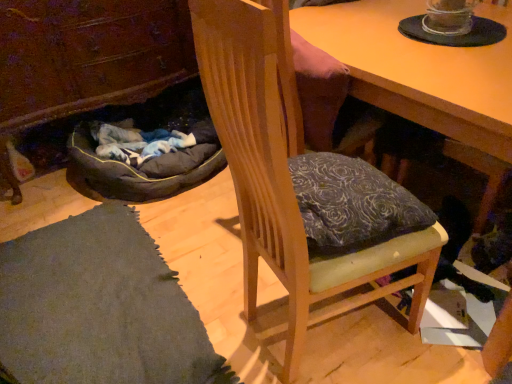
The image size is (512, 384). I want to click on wooden cabinet at lower left, so click(x=85, y=59).

Describe the element at coordinates (421, 69) in the screenshot. I see `wooden desk at center` at that location.

This screenshot has height=384, width=512. I want to click on wooden cabinet at lower left, so click(85, 59).

Considering the sizes of objects wooden cabinet at lower left and wooden chair at center in the image provided, who is smaller, wooden cabinet at lower left or wooden chair at center?

wooden chair at center is smaller.

Which point is more forward, (x=112, y=86) or (x=255, y=106)?

Positioned in front is point (x=255, y=106).

Identify the location of cabinetry above the wooden chair at center (from the image's perspective). (85, 59).

Is wooden cabinet at lower left wider than wooden chair at center?

Correct, the width of wooden cabinet at lower left exceeds that of wooden chair at center.

From a real-world perspective, between wooden desk at center and wooden chair at center, who is vertically lower?

From a 3D spatial view, wooden desk at center is below.

Measure the distance between wooden desk at center and wooden chair at center.

wooden desk at center and wooden chair at center are 17.77 inches apart.

From the image's perspective, is wooden desk at center under wooden chair at center?

No.

Is point (367, 80) farther from camera compared to point (394, 271)?

Yes, it is.

Considering the relative sizes of wooden cabinet at lower left and wooden desk at center in the image provided, is wooden cabinet at lower left shorter than wooden desk at center?

No, wooden cabinet at lower left is not shorter than wooden desk at center.

Based on their sizes in the image, would you say wooden cabinet at lower left is bigger or smaller than wooden desk at center?

Considering their sizes, wooden cabinet at lower left takes up less space than wooden desk at center.

Would you consider wooden cabinet at lower left to be distant from wooden desk at center?

wooden cabinet at lower left is positioned a significant distance from wooden desk at center.

Is wooden cabinet at lower left positioned with its back to wooden desk at center?

No, wooden cabinet at lower left is not facing away from wooden desk at center.

From a real-world perspective, is wooden chair at center beneath wooden cabinet at lower left?

Actually, wooden chair at center is physically above wooden cabinet at lower left in the real world.

From the picture: Who is more distant, wooden chair at center or wooden cabinet at lower left?

wooden cabinet at lower left is further away from the camera.

There is a wooden cabinet at lower left. At what (x,y) coordinates should I click in order to perform the action: click on chair above it (from a real-world perspective). Please return your answer as a coordinate pair (x, y). The width and height of the screenshot is (512, 384). Looking at the image, I should click on (285, 178).

Would you say wooden desk at center is outside wooden cabinet at lower left?

Absolutely, wooden desk at center is external to wooden cabinet at lower left.

Is wooden desk at center oriented away from wooden cabinet at lower left?

wooden desk at center is not turned away from wooden cabinet at lower left.

Can you confirm if wooden desk at center is positioned to the right of wooden cabinet at lower left?

Correct, you'll find wooden desk at center to the right of wooden cabinet at lower left.

From the image's perspective, does wooden chair at center appear lower than wooden desk at center?

Correct, wooden chair at center appears lower than wooden desk at center in the image.

In terms of height, does wooden chair at center look taller or shorter compared to wooden desk at center?

In the image, wooden chair at center appears to be taller than wooden desk at center.

Where is `chair below the wooden desk at center (from the image's perspective)`? chair below the wooden desk at center (from the image's perspective) is located at coordinates (285, 178).

At what (x,y) coordinates should I click in order to perform the action: click on cabinetry behind the wooden chair at center. Please return your answer as a coordinate pair (x, y). Looking at the image, I should click on click(85, 59).

Find the location of a particular element. desk located underneath the wooden chair at center (from a real-world perspective) is located at coordinates (421, 69).

Estimate the real-world distances between objects in this image. Which object is further from wooden cabinet at lower left, wooden desk at center or wooden chair at center?

The object further to wooden cabinet at lower left is wooden chair at center.

From the image, which object appears to be nearer to wooden cabinet at lower left, wooden chair at center or wooden desk at center?

Among the two, wooden desk at center is located nearer to wooden cabinet at lower left.

Considering their positions, is wooden cabinet at lower left positioned closer to wooden chair at center than wooden desk at center?

wooden desk at center.

When comparing their distances from wooden desk at center, does wooden chair at center or wooden cabinet at lower left seem further?

wooden cabinet at lower left lies further to wooden desk at center than the other object.

Looking at the image, which one is located further to wooden desk at center, wooden cabinet at lower left or wooden chair at center?

Among the two, wooden cabinet at lower left is located further to wooden desk at center.

Looking at the image, which one is located closer to wooden chair at center, wooden desk at center or wooden cabinet at lower left?

Among the two, wooden desk at center is located nearer to wooden chair at center.

Locate an element on the screen. chair between wooden cabinet at lower left and wooden desk at center in the horizontal direction is located at coordinates (285, 178).